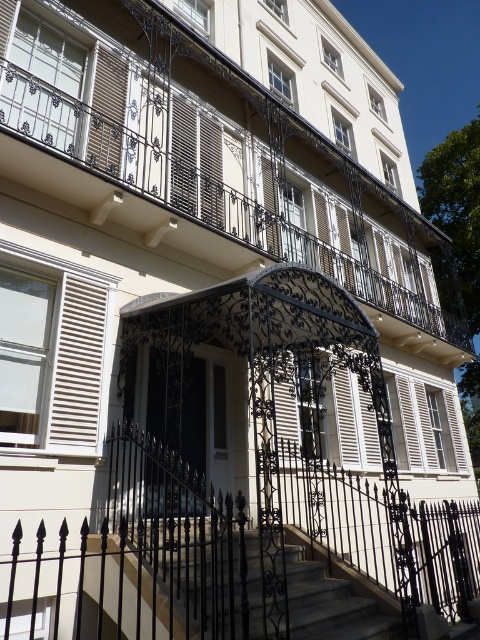
In order to click on smooth stone stairs at center in this screenshot , I will do `click(332, 604)`.

Which is in front, point (299, 576) or point (60, 392)?

Point (60, 392)

Measure the distance between point (x=311, y=588) and camera.

They are 16.85 feet apart.

This screenshot has width=480, height=640. I want to click on smooth stone stairs at center, so click(332, 604).

Does black wrought iron balcony at center appear under white matte shutter at upper left?

No.

Between black wrought iron balcony at center and white matte shutter at upper left, which one is positioned lower?

Positioned lower is white matte shutter at upper left.

Describe the element at coordinates (241, 140) in the screenshot. The image size is (480, 640). I see `black wrought iron balcony at center` at that location.

You are a GUI agent. You are given a task and a screenshot of the screen. Output one action in this format:
    pyautogui.click(x=<x>, y=<y>)
    Task: Click on the black wrought iron balcony at center
    
    Given the screenshot: What is the action you would take?
    [x=241, y=140]

Does black wrought iron balcony at center have a lesser height compared to white matte shutter at left?

No.

Between point (452, 332) and point (104, 320), which one is positioned behind?

The point (452, 332) is more distant.

At what (x,y) coordinates should I click in order to perform the action: click on black wrought iron balcony at center. Please return your answer as a coordinate pair (x, y). The height and width of the screenshot is (640, 480). Looking at the image, I should click on 241,140.